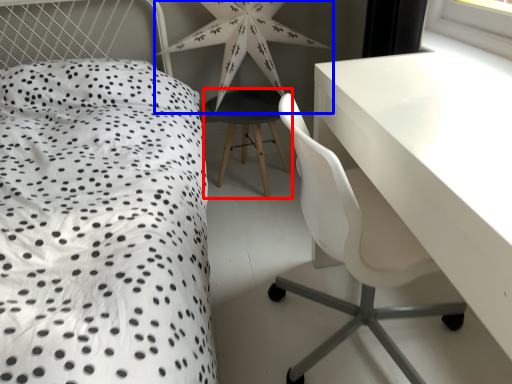
Question: Which point is closer to the camera, bar stool (highlighted by a red box) or star (highlighted by a blue box)?

Choices:
 (A) bar stool
 (B) star

Answer: (B)